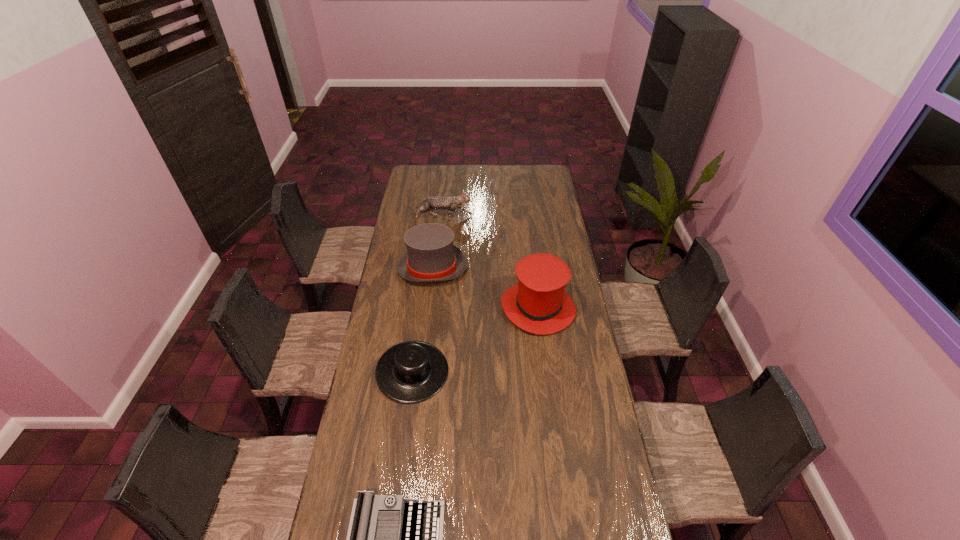
You are a GUI agent. You are given a task and a screenshot of the screen. Output one action in this format:
    pyautogui.click(x=<x>, y=<y>)
    Task: Click on the rightmost dress hat
    Image resolution: width=960 pixels, height=540 pixels.
    Given the screenshot: What is the action you would take?
    pyautogui.click(x=539, y=304)

Image resolution: width=960 pixels, height=540 pixels. I want to click on the third tallest object, so click(433, 202).

At what (x,y) coordinates should I click in order to perform the action: click on cat. Please return your answer as a coordinate pair (x, y). The image size is (960, 540). Looking at the image, I should click on (433, 202).

This screenshot has height=540, width=960. What are the coordinates of `the shortest dress hat` in the screenshot? It's located at (413, 371).

Identify the location of the fourth farthest object. (413, 371).

Locate an element on the screen. free spot located on the front of the rightmost dress hat is located at coordinates (548, 388).

You are a GUI agent. You are given a task and a screenshot of the screen. Output one action in this format:
    pyautogui.click(x=<x>, y=<y>)
    Task: Click on the vacant area located on the face of the third shortest object
    This screenshot has height=540, width=960.
    Given the screenshot: What is the action you would take?
    pyautogui.click(x=533, y=218)

The image size is (960, 540). Identify the location of free space located on the front of the fourth tallest object. (405, 430).

I want to click on cat located at the left edge, so click(x=433, y=202).

This screenshot has width=960, height=540. In order to click on object at the right edge in this screenshot , I will do `click(539, 304)`.